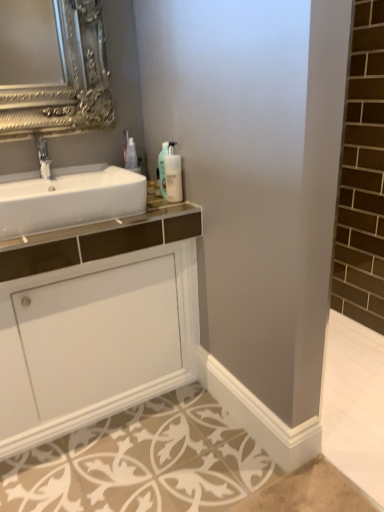
I want to click on white painted wood baseboard at lower center, so click(x=260, y=416).

This screenshot has height=512, width=384. Identify the location of translucent plastic bottle at upper right. [x=131, y=155].

Describe the element at coordinates (131, 155) in the screenshot. I see `translucent plastic bottle at upper right` at that location.

Where is `white glossy sink at left`? This screenshot has height=512, width=384. white glossy sink at left is located at coordinates pos(68,198).

The width and height of the screenshot is (384, 512). What do you see at coordinates (43, 157) in the screenshot? I see `matte silver faucet at left` at bounding box center [43, 157].

Describe the element at coordinates (162, 169) in the screenshot. I see `translucent plastic soap dispenser at upper center, the second soap dispenser from the right` at that location.

This screenshot has height=512, width=384. What do you see at coordinates (173, 175) in the screenshot? I see `translucent plastic soap dispenser at upper center, which is the 1th soap dispenser from right to left` at bounding box center [173, 175].

In order to click on white painted wood baseboard at lower center in this screenshot , I will do `click(260, 416)`.

Is white painted wood baseboard at lower center located outside white glossy sink at left?

Yes, white painted wood baseboard at lower center is located beyond the bounds of white glossy sink at left.

Is white painted wood baseboard at lower center bigger than white glossy sink at left?

Actually, white painted wood baseboard at lower center might be smaller than white glossy sink at left.

Is white painted wood baseboard at lower center aimed at white glossy sink at left?

No, white painted wood baseboard at lower center is not aimed at white glossy sink at left.

There is a white glossy sink at left. Where is `the 2nd soap dispenser above it (from the image's perspective)`? the 2nd soap dispenser above it (from the image's perspective) is located at coordinates (162, 169).

Is white glossy sink at left surrounding translucent plastic soap dispenser at upper center, the second soap dispenser from the right?

Definitely not — translucent plastic soap dispenser at upper center, the second soap dispenser from the right, is not inside white glossy sink at left.

From a real-world perspective, is white glossy sink at left on translucent plastic soap dispenser at upper center, acting as the first soap dispenser starting from the left?

No.

From the image's perspective, who appears lower, translucent plastic bottle at upper right or translucent plastic soap dispenser at upper center, which is the 1th soap dispenser from right to left?

translucent plastic soap dispenser at upper center, which is the 1th soap dispenser from right to left, appears lower in the image.

From a real-world perspective, is translucent plastic bottle at upper right on translucent plastic soap dispenser at upper center, the 2th soap dispenser from the left?

Yes, from a real-world perspective, translucent plastic bottle at upper right is above translucent plastic soap dispenser at upper center, the 2th soap dispenser from the left.

Can you confirm if translucent plastic bottle at upper right is wider than translucent plastic soap dispenser at upper center, the 2th soap dispenser from the left?

No.

Could you tell me if translucent plastic bottle at upper right is turned towards translucent plastic soap dispenser at upper center, the 2th soap dispenser from the left?

Yes, translucent plastic bottle at upper right is turned towards translucent plastic soap dispenser at upper center, the 2th soap dispenser from the left.

How many degrees apart are the facing directions of matte silver faucet at left and white glossy sink at left?

1.48 degrees separate the facing orientations of matte silver faucet at left and white glossy sink at left.

From their relative heights in the image, would you say matte silver faucet at left is taller or shorter than white glossy sink at left?

In the image, matte silver faucet at left appears to be taller than white glossy sink at left.

Identify the location of sink that is in front of the matte silver faucet at left. This screenshot has height=512, width=384. (68, 198).

Measure the distance from matte silver faucet at left to white glossy sink at left.

The distance of matte silver faucet at left from white glossy sink at left is 9.78 inches.

Does translucent plastic bottle at upper right have a smaller size compared to white painted wood baseboard at lower center?

Yes.

In the scene shown: Is translucent plastic bottle at upper right aimed at white painted wood baseboard at lower center?

No, translucent plastic bottle at upper right is not facing towards white painted wood baseboard at lower center.

Is translucent plastic bottle at upper right touching white painted wood baseboard at lower center?

There is a gap between translucent plastic bottle at upper right and white painted wood baseboard at lower center.

What's the angular difference between translucent plastic bottle at upper right and white painted wood baseboard at lower center's facing directions?

There is a 91.6-degree angle between the facing directions of translucent plastic bottle at upper right and white painted wood baseboard at lower center.

Is the surface of white glossy cabinet at center in direct contact with translucent plastic soap dispenser at upper center, acting as the first soap dispenser starting from the left?

No, white glossy cabinet at center is not touching translucent plastic soap dispenser at upper center, acting as the first soap dispenser starting from the left.

Which is correct: white glossy cabinet at center is inside translucent plastic soap dispenser at upper center, acting as the first soap dispenser starting from the left, or outside of it?

white glossy cabinet at center is located beyond the bounds of translucent plastic soap dispenser at upper center, acting as the first soap dispenser starting from the left.

Does white glossy cabinet at center have a lesser height compared to translucent plastic soap dispenser at upper center, the second soap dispenser from the right?

No.

Measure the distance between translucent plastic bottle at upper right and translucent plastic soap dispenser at upper center, the second soap dispenser from the right.

translucent plastic bottle at upper right and translucent plastic soap dispenser at upper center, the second soap dispenser from the right, are 9.19 inches apart from each other.

Does translucent plastic bottle at upper right have a lesser width compared to translucent plastic soap dispenser at upper center, the second soap dispenser from the right?

Correct, the width of translucent plastic bottle at upper right is less than that of translucent plastic soap dispenser at upper center, the second soap dispenser from the right.

Considering the positions of objects translucent plastic bottle at upper right and translucent plastic soap dispenser at upper center, acting as the first soap dispenser starting from the left, in the image provided, who is behind, translucent plastic bottle at upper right or translucent plastic soap dispenser at upper center, acting as the first soap dispenser starting from the left,?

translucent plastic bottle at upper right is behind.

Between translucent plastic bottle at upper right and translucent plastic soap dispenser at upper center, the second soap dispenser from the right, which one appears on the right side from the viewer's perspective?

translucent plastic soap dispenser at upper center, the second soap dispenser from the right.

The width and height of the screenshot is (384, 512). I want to click on molding lying behind the white glossy sink at left, so click(260, 416).

The width and height of the screenshot is (384, 512). What are the coordinates of `sink below the translucent plastic soap dispenser at upper center, the second soap dispenser from the right (from the image's perspective)` in the screenshot? It's located at (68, 198).

Considering their positions, is matte silver faucet at left positioned further to white painted wood baseboard at lower center than translucent plastic bottle at upper right?

The object further to white painted wood baseboard at lower center is matte silver faucet at left.

Looking at the image, which one is located closer to matte silver faucet at left, translucent plastic bottle at upper right or white painted wood baseboard at lower center?

The object closer to matte silver faucet at left is translucent plastic bottle at upper right.

Based on their spatial positions, is translucent plastic soap dispenser at upper center, the second soap dispenser from the right, or translucent plastic soap dispenser at upper center, which is the 1th soap dispenser from right to left, further from white painted wood baseboard at lower center?

translucent plastic soap dispenser at upper center, the second soap dispenser from the right, is positioned further to the anchor white painted wood baseboard at lower center.

Estimate the real-world distances between objects in this image. Which object is further from matte silver faucet at left, translucent plastic soap dispenser at upper center, the 2th soap dispenser from the left, or translucent plastic soap dispenser at upper center, the second soap dispenser from the right?

translucent plastic soap dispenser at upper center, the 2th soap dispenser from the left, lies further to matte silver faucet at left than the other object.

Consider the image. Estimate the real-world distances between objects in this image. Which object is closer to white glossy cabinet at center, translucent plastic soap dispenser at upper center, which is the 1th soap dispenser from right to left, or white glossy sink at left?

white glossy sink at left lies closer to white glossy cabinet at center than the other object.

Which object lies further to the anchor point white painted wood baseboard at lower center, white glossy cabinet at center or matte silver faucet at left?

matte silver faucet at left is positioned further to the anchor white painted wood baseboard at lower center.

Based on their spatial positions, is white painted wood baseboard at lower center or matte silver faucet at left further from white glossy sink at left?

white painted wood baseboard at lower center is positioned further to the anchor white glossy sink at left.

Consider the image. Looking at the image, which one is located closer to translucent plastic soap dispenser at upper center, acting as the first soap dispenser starting from the left, translucent plastic soap dispenser at upper center, which is the 1th soap dispenser from right to left, or white painted wood baseboard at lower center?

Among the two, translucent plastic soap dispenser at upper center, which is the 1th soap dispenser from right to left, is located nearer to translucent plastic soap dispenser at upper center, acting as the first soap dispenser starting from the left.

What are the coordinates of `bathroom cabinet between matte silver faucet at left and white painted wood baseboard at lower center vertically` in the screenshot? It's located at (96, 322).

You are a GUI agent. You are given a task and a screenshot of the screen. Output one action in this format:
    pyautogui.click(x=<x>, y=<y>)
    Task: Click on the soap dispenser situated between translucent plastic bottle at upper right and translucent plastic soap dispenser at upper center, which is the 1th soap dispenser from right to left, from left to right
    This screenshot has height=512, width=384.
    Given the screenshot: What is the action you would take?
    pyautogui.click(x=162, y=169)

At what (x,y) coordinates should I click in order to perform the action: click on soap dispenser between translucent plastic soap dispenser at upper center, acting as the first soap dispenser starting from the left, and white painted wood baseboard at lower center in the up-down direction. Please return your answer as a coordinate pair (x, y). Looking at the image, I should click on (173, 175).

This screenshot has height=512, width=384. In order to click on sink between translucent plastic soap dispenser at upper center, the 2th soap dispenser from the left, and white painted wood baseboard at lower center, in the vertical direction in this screenshot , I will do `click(68, 198)`.